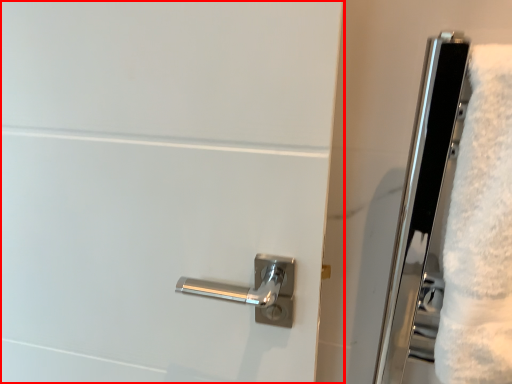
Question: From the image's perspective, what is the correct spatial relationship of door (annotated by the red box) in relation to bath towel?

Choices:
 (A) below
 (B) above

Answer: (A)